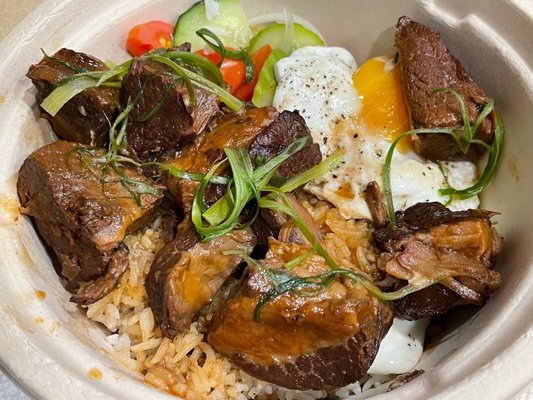
At what (x,y) coordinates should I click in order to perform the action: click on borders counter/table. Please return your answer as a coordinate pair (x, y). Looking at the image, I should click on (18, 16), (519, 5), (524, 391), (16, 393).